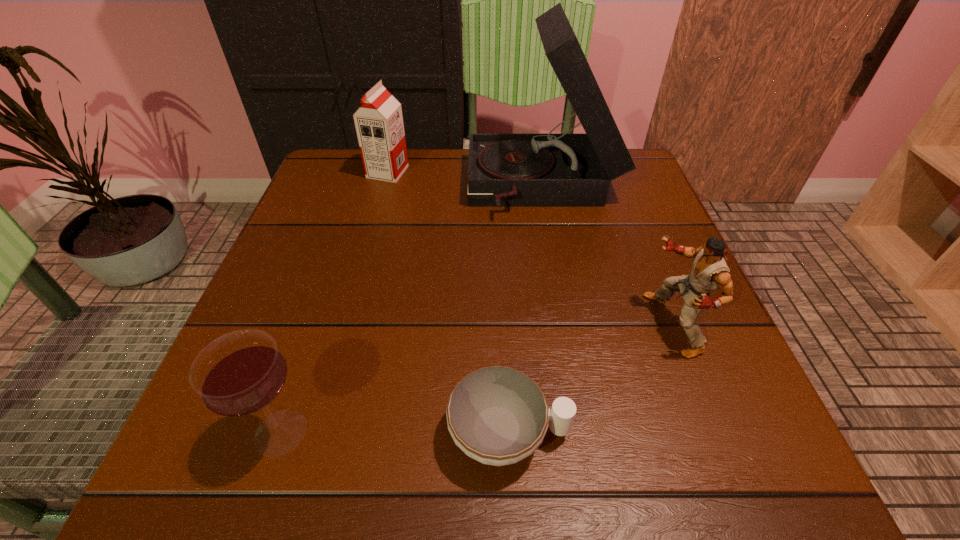
Identify the location of phonograph_record located in the right edge section of the desktop. (505, 170).

Where is `puncher positioned at the right edge`? This screenshot has height=540, width=960. puncher positioned at the right edge is located at coordinates (710, 272).

Find the location of a particular element. Image resolution: width=960 pixels, height=540 pixels. object at the far left corner is located at coordinates (379, 125).

You are a GUI agent. You are given a task and a screenshot of the screen. Output one action in this format:
    pyautogui.click(x=<x>, y=<y>)
    Task: Click on the object at the near left corner
    The width and height of the screenshot is (960, 540).
    Given the screenshot: What is the action you would take?
    pyautogui.click(x=241, y=373)

The width and height of the screenshot is (960, 540). I want to click on object that is at the far right corner, so pyautogui.click(x=505, y=170).

You are a GUI agent. You are given a task and a screenshot of the screen. Output one action in this format:
    pyautogui.click(x=<x>, y=<y>)
    Task: Click on the vacant space at the far edge of the desktop
    The image size is (960, 540).
    Given the screenshot: What is the action you would take?
    pyautogui.click(x=436, y=170)

This screenshot has width=960, height=540. In the image, there is a desktop. What are the coordinates of `vacant area at the near edge` in the screenshot? It's located at (444, 478).

This screenshot has width=960, height=540. What are the coordinates of `vacant area at the left edge` in the screenshot? It's located at (302, 219).

The height and width of the screenshot is (540, 960). In order to click on vacant space at the right edge of the desktop in this screenshot , I will do `click(612, 242)`.

Where is `vacant space at the far left corner of the desktop`? vacant space at the far left corner of the desktop is located at coordinates (348, 170).